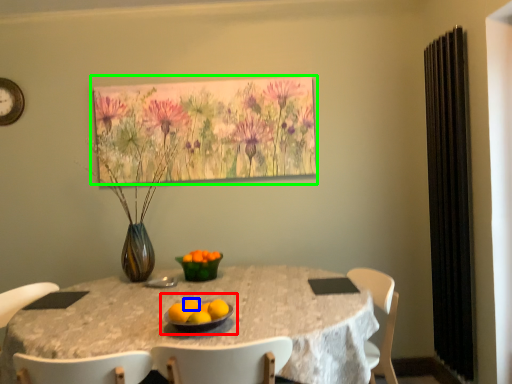
Question: Estimate the real-world distances between objects in this image. Which object is farther from fruit dish (highlighted by a red box), orange (highlighted by a blue box) or floral arrangement (highlighted by a green box)?

Choices:
 (A) orange
 (B) floral arrangement

Answer: (B)